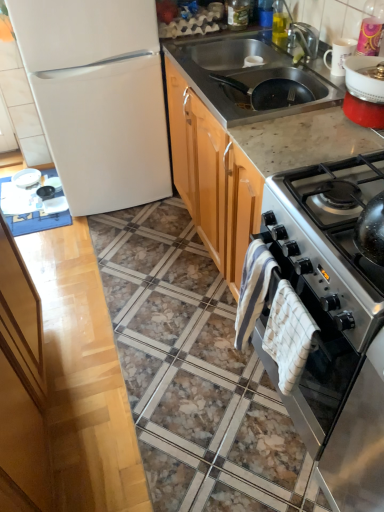
Question: Is stainless steel sink at upper right turned away from satin silver oven at right?

Choices:
 (A) no
 (B) yes

Answer: (A)

Question: From the image's perspective, does stainless steel sink at upper right appear lower than satin silver oven at right?

Choices:
 (A) no
 (B) yes

Answer: (A)

Question: Can we say stainless steel sink at upper right lies outside satin silver oven at right?

Choices:
 (A) no
 (B) yes

Answer: (B)

Question: Are stainless steel sink at upper right and satin silver oven at right located far from each other?

Choices:
 (A) yes
 (B) no

Answer: (B)

Question: From a real-world perspective, is stainless steel sink at upper right located beneath satin silver oven at right?

Choices:
 (A) no
 (B) yes

Answer: (A)

Question: Does stainless steel sink at upper right come in front of satin silver oven at right?

Choices:
 (A) no
 (B) yes

Answer: (A)

Question: Is white matte refrigerator at left placed right next to white ceramic mug at upper right, the 2th appliance positioned from the bottom?

Choices:
 (A) no
 (B) yes

Answer: (A)

Question: Can you confirm if white matte refrigerator at left is positioned to the right of white ceramic mug at upper right, placed as the 2th appliance when sorted from back to front?

Choices:
 (A) no
 (B) yes

Answer: (A)

Question: Can you confirm if white matte refrigerator at left is bigger than white ceramic mug at upper right, placed as the 1th appliance when sorted from top to bottom?

Choices:
 (A) yes
 (B) no

Answer: (A)

Question: Does white matte refrigerator at left have a greater height compared to white ceramic mug at upper right, placed as the 2th appliance when sorted from back to front?

Choices:
 (A) no
 (B) yes

Answer: (B)

Question: From the image's perspective, would you say white matte refrigerator at left is positioned over white ceramic mug at upper right, the 2th appliance positioned from the bottom?

Choices:
 (A) no
 (B) yes

Answer: (B)

Question: From the image's perspective, is white matte refrigerator at left beneath white ceramic mug at upper right, positioned as the 2th appliance in left-to-right order?

Choices:
 (A) yes
 (B) no

Answer: (B)

Question: Is the position of satin silver oven at right more distant than that of white glossy plate at upper left, which ranks as the first appliance in left-to-right order?

Choices:
 (A) yes
 (B) no

Answer: (B)